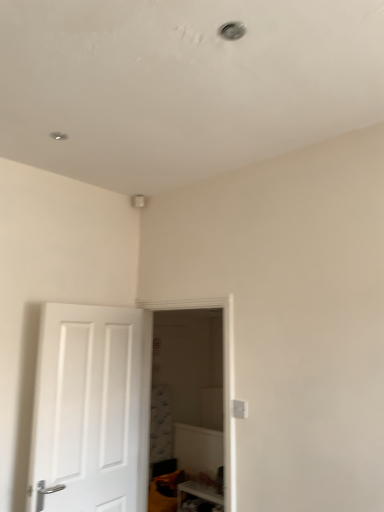
Question: From a real-world perspective, is white matte door at left physically located above or below white glossy shelf at lower right?

Choices:
 (A) below
 (B) above

Answer: (B)

Question: Considering the positions of white matte door at left and white glossy shelf at lower right in the image, is white matte door at left wider or thinner than white glossy shelf at lower right?

Choices:
 (A) wide
 (B) thin

Answer: (B)

Question: Which is farther from the transparent glass door at center?

Choices:
 (A) white matte door at left
 (B) white glossy shelf at lower right

Answer: (B)

Question: Which of these objects is positioned farthest from the transparent glass door at center?

Choices:
 (A) white matte door at left
 (B) white glossy shelf at lower right

Answer: (B)